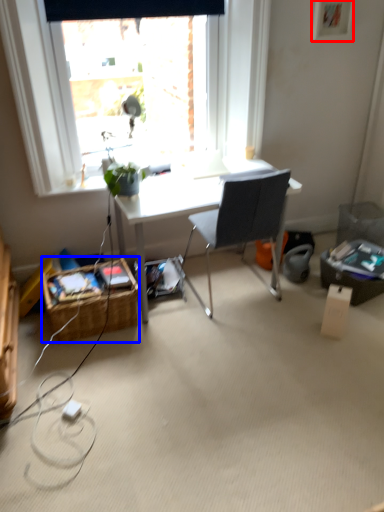
Question: Which object appears farthest to the camera in this image, picture frame (highlighted by a red box) or picnic basket (highlighted by a blue box)?

Choices:
 (A) picture frame
 (B) picnic basket

Answer: (A)